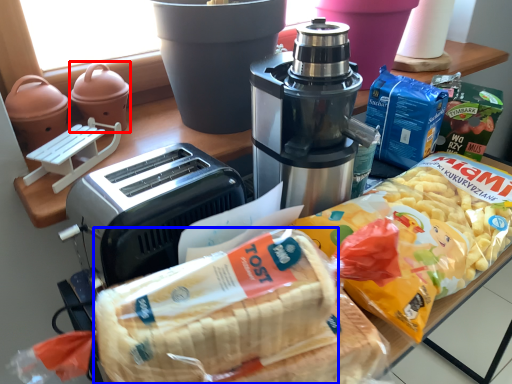
Question: Among these objects, which one is nearest to the camera, appliance (highlighted by a red box) or treat (highlighted by a blue box)?

Choices:
 (A) appliance
 (B) treat

Answer: (B)